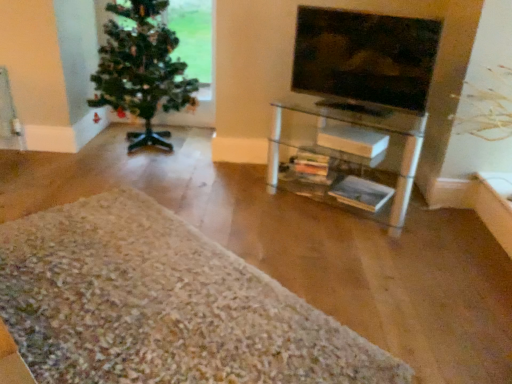
Question: Can you confirm if white shaggy rug at lower left is thinner than matte glass tv at upper right?

Choices:
 (A) yes
 (B) no

Answer: (B)

Question: Is the position of white shaggy rug at lower left more distant than that of matte glass tv at upper right?

Choices:
 (A) no
 (B) yes

Answer: (A)

Question: Is white shaggy rug at lower left far from matte glass tv at upper right?

Choices:
 (A) no
 (B) yes

Answer: (B)

Question: Is white shaggy rug at lower left looking in the opposite direction of matte glass tv at upper right?

Choices:
 (A) no
 (B) yes

Answer: (A)

Question: Considering the relative sizes of white shaggy rug at lower left and matte glass tv at upper right in the image provided, is white shaggy rug at lower left bigger than matte glass tv at upper right?

Choices:
 (A) no
 (B) yes

Answer: (B)

Question: Considering the relative sizes of white shaggy rug at lower left and matte glass tv at upper right in the image provided, is white shaggy rug at lower left shorter than matte glass tv at upper right?

Choices:
 (A) yes
 (B) no

Answer: (A)

Question: Is green matte christmas tree at left wider than white shaggy rug at lower left?

Choices:
 (A) no
 (B) yes

Answer: (A)

Question: Is white shaggy rug at lower left surrounded by green matte christmas tree at left?

Choices:
 (A) yes
 (B) no

Answer: (B)

Question: From a real-world perspective, is green matte christmas tree at left physically below white shaggy rug at lower left?

Choices:
 (A) yes
 (B) no

Answer: (B)

Question: From the image's perspective, is green matte christmas tree at left beneath white shaggy rug at lower left?

Choices:
 (A) yes
 (B) no

Answer: (B)

Question: Does green matte christmas tree at left lie in front of white shaggy rug at lower left?

Choices:
 (A) no
 (B) yes

Answer: (A)

Question: Is green matte christmas tree at left not within white shaggy rug at lower left?

Choices:
 (A) no
 (B) yes

Answer: (B)

Question: Is green matte christmas tree at left taller than matte glass tv at upper right?

Choices:
 (A) yes
 (B) no

Answer: (A)